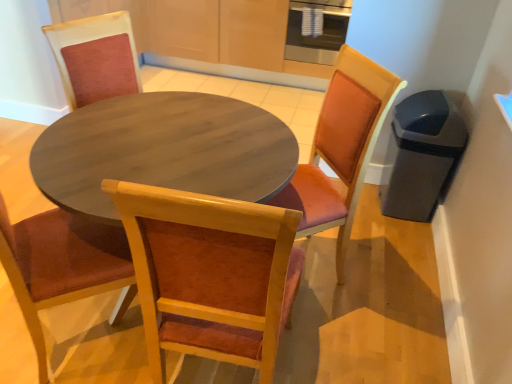
The height and width of the screenshot is (384, 512). I want to click on vacant area that is in front of wooden chair with orange cushion at center, positioned as the 2th chair in front-to-back order, so click(329, 338).